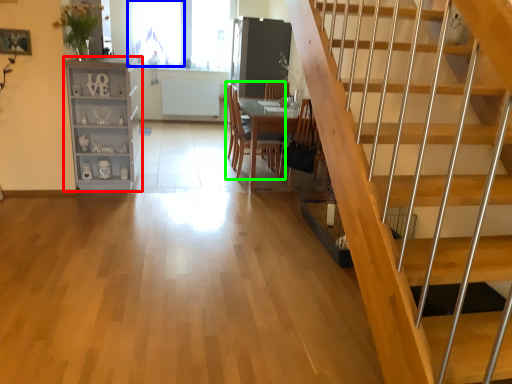
Question: Based on their relative distances, which object is nearer to shelf (highlighted by a red box)? Choose from window (highlighted by a blue box) and chair (highlighted by a green box).

Choices:
 (A) window
 (B) chair

Answer: (B)